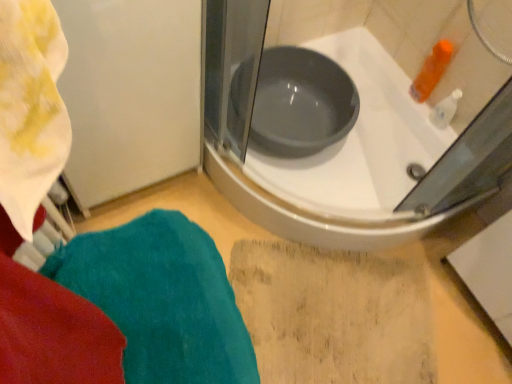
Question: Is white glossy bathtub at upper center taller than teal plush towel at lower left?

Choices:
 (A) no
 (B) yes

Answer: (A)

Question: From the image's perspective, is white glossy bathtub at upper center over teal plush towel at lower left?

Choices:
 (A) yes
 (B) no

Answer: (A)

Question: Is white glossy bathtub at upper center oriented towards teal plush towel at lower left?

Choices:
 (A) yes
 (B) no

Answer: (B)

Question: Is white glossy bathtub at upper center thinner than teal plush towel at lower left?

Choices:
 (A) yes
 (B) no

Answer: (B)

Question: Considering the relative positions of white glossy bathtub at upper center and teal plush towel at lower left in the image provided, is white glossy bathtub at upper center to the left of teal plush towel at lower left from the viewer's perspective?

Choices:
 (A) no
 (B) yes

Answer: (A)

Question: Would you say matte gray basin at center is to the left or to the right of white glossy bathtub at upper center in the picture?

Choices:
 (A) left
 (B) right

Answer: (A)

Question: From the image's perspective, relative to white glossy bathtub at upper center, is matte gray basin at center above or below?

Choices:
 (A) above
 (B) below

Answer: (A)

Question: In terms of width, does matte gray basin at center look wider or thinner when compared to white glossy bathtub at upper center?

Choices:
 (A) thin
 (B) wide

Answer: (A)

Question: From a real-world perspective, is matte gray basin at center physically located above or below white glossy bathtub at upper center?

Choices:
 (A) below
 (B) above

Answer: (B)

Question: In terms of height, does matte gray basin at center look taller or shorter compared to teal plush towel at lower left?

Choices:
 (A) short
 (B) tall

Answer: (A)

Question: Relative to teal plush towel at lower left, is matte gray basin at center in front or behind?

Choices:
 (A) front
 (B) behind

Answer: (B)

Question: Choose the correct answer: Is matte gray basin at center inside teal plush towel at lower left or outside it?

Choices:
 (A) inside
 (B) outside

Answer: (B)

Question: Is matte gray basin at center wider or thinner than teal plush towel at lower left?

Choices:
 (A) thin
 (B) wide

Answer: (B)

Question: Considering the positions of teal plush towel at lower left and matte gray basin at center in the image, is teal plush towel at lower left taller or shorter than matte gray basin at center?

Choices:
 (A) tall
 (B) short

Answer: (A)

Question: From the image's perspective, relative to matte gray basin at center, is teal plush towel at lower left above or below?

Choices:
 (A) below
 (B) above

Answer: (A)